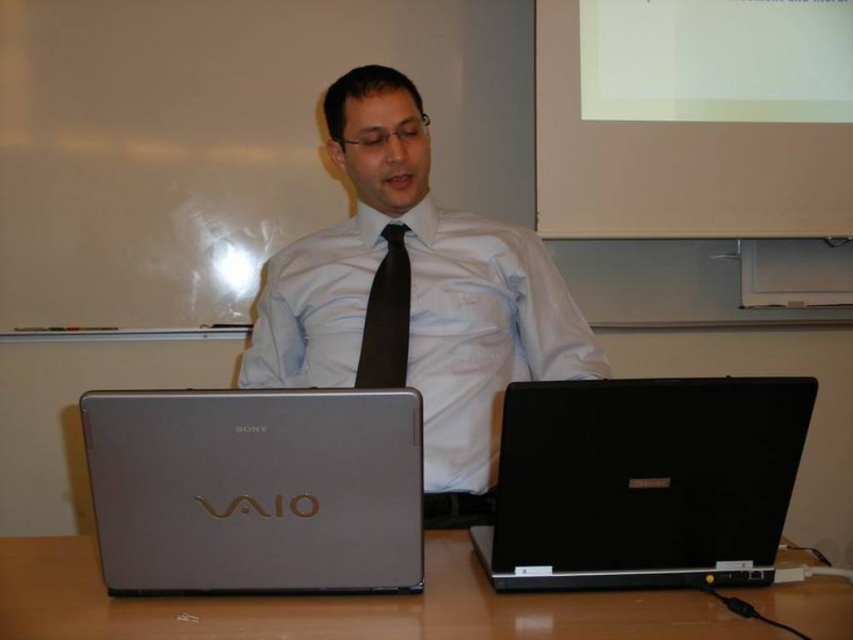
Can you confirm if matte silver laptop at center is positioned above wooden table at lower center?

Yes.

Between point (366, 291) and point (483, 577), which one is positioned in front?

Positioned in front is point (483, 577).

I want to click on matte silver laptop at center, so click(x=415, y=291).

Between point (599, 560) and point (32, 557), which one is positioned behind?

Positioned behind is point (32, 557).

Is black matte laptop at lower right below wooden table at lower center?

Answer: No, black matte laptop at lower right is not below wooden table at lower center.

Locate an element on the screen. The height and width of the screenshot is (640, 853). black matte laptop at lower right is located at coordinates (643, 481).

Does matte silver laptop at center have a lesser height compared to black matte laptop at lower right?

In fact, matte silver laptop at center may be taller than black matte laptop at lower right.

Is point (422, 369) positioned in front of point (570, 417)?

No, (422, 369) is further to viewer.

Does point (381, 256) come in front of point (524, 474)?

No, it is not.

Locate an element on the screen. matte silver laptop at center is located at coordinates (415, 291).